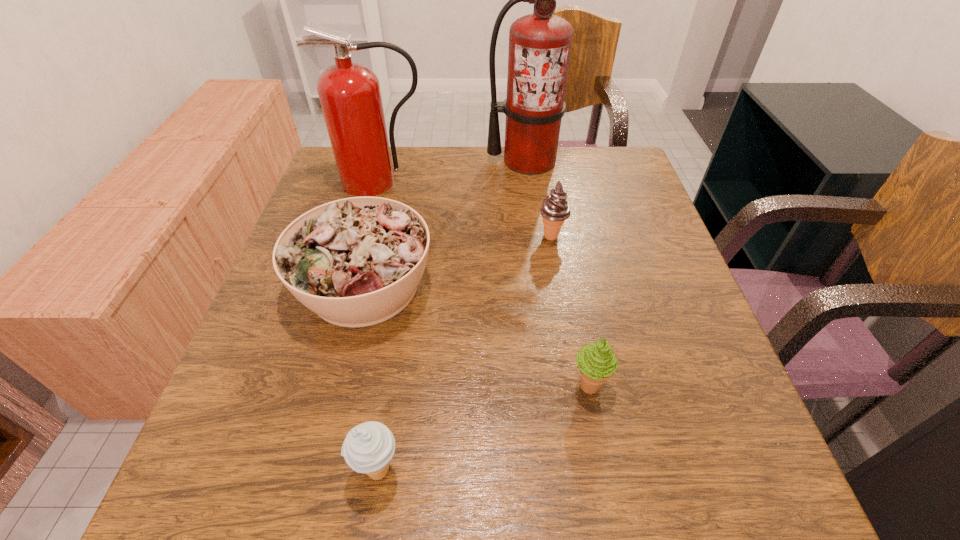
Find the location of `blank space at the left edge of the desktop`. blank space at the left edge of the desktop is located at coordinates (263, 370).

Locate an element on the screen. Image resolution: width=960 pixels, height=540 pixels. free location at the right edge is located at coordinates (641, 245).

In the image, there is a desktop. At what (x,y) coordinates should I click in order to perform the action: click on vacant area at the far right corner. Please return your answer as a coordinate pair (x, y). Looking at the image, I should click on (x=593, y=162).

Where is `vacant area at the near right corner of the desktop`? vacant area at the near right corner of the desktop is located at coordinates (763, 468).

Locate an element on the screen. blank region between the nearest object and the right fire extinguisher is located at coordinates (453, 315).

The height and width of the screenshot is (540, 960). Find the location of `free space between the salad and the tallest object`. free space between the salad and the tallest object is located at coordinates (446, 224).

In order to click on vacant area that lies between the shorter fire extinguisher and the nearest icecream in this screenshot , I will do `click(379, 326)`.

Where is `free spot between the farthest icecream and the shorter fire extinguisher`? This screenshot has height=540, width=960. free spot between the farthest icecream and the shorter fire extinguisher is located at coordinates (467, 209).

Find the location of a particular element. This screenshot has width=960, height=540. blank region between the farthest icecream and the shorter fire extinguisher is located at coordinates (467, 209).

At what (x,y) coordinates should I click in order to perform the action: click on free space between the salad and the farthest icecream. Please return your answer as a coordinate pair (x, y). Looking at the image, I should click on (458, 261).